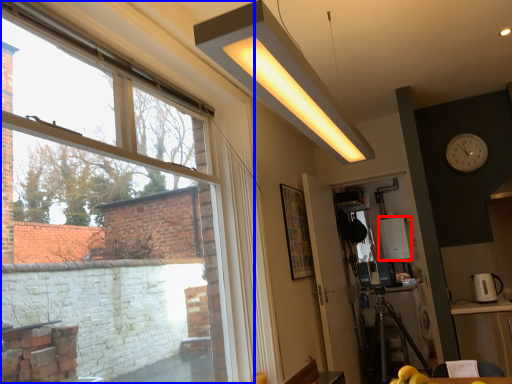
Question: Which point is closer to the camera, appliance (highlighted by a red box) or window (highlighted by a blue box)?

Choices:
 (A) appliance
 (B) window

Answer: (B)